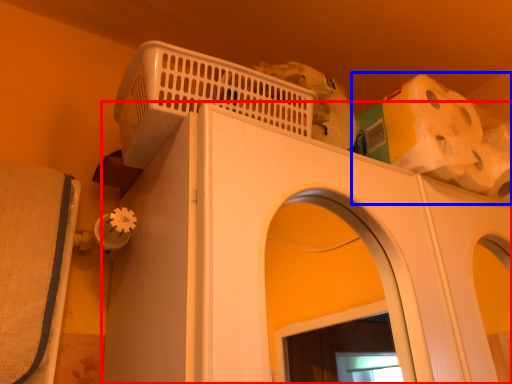
Question: Among these objects, which one is nearest to the camera, home appliance (highlighted by a red box) or toilet paper (highlighted by a blue box)?

Choices:
 (A) home appliance
 (B) toilet paper

Answer: (A)